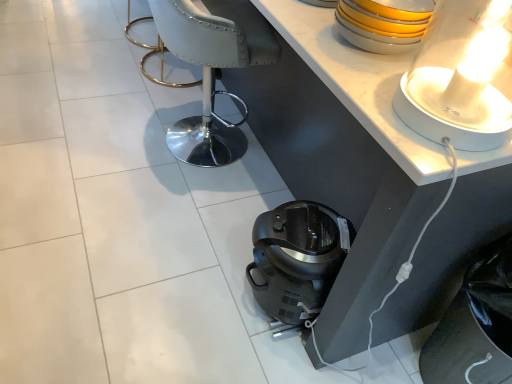
Question: Considering the relative positions of white glossy table at upper center and white leather armchair at center in the image provided, is white glossy table at upper center in front of white leather armchair at center?

Choices:
 (A) yes
 (B) no

Answer: (A)

Question: Is white glossy table at upper center wider than white leather armchair at center?

Choices:
 (A) yes
 (B) no

Answer: (A)

Question: Does white glossy table at upper center have a greater height compared to white leather armchair at center?

Choices:
 (A) no
 (B) yes

Answer: (A)

Question: Considering the relative sizes of white glossy table at upper center and white leather armchair at center in the image provided, is white glossy table at upper center thinner than white leather armchair at center?

Choices:
 (A) yes
 (B) no

Answer: (B)

Question: From a real-world perspective, is white glossy table at upper center positioned under white leather armchair at center based on gravity?

Choices:
 (A) no
 (B) yes

Answer: (B)

Question: From their relative heights in the image, would you say satin black coffee maker at lower center is taller or shorter than white glossy table at upper center?

Choices:
 (A) tall
 (B) short

Answer: (A)

Question: Considering the positions of satin black coffee maker at lower center and white glossy table at upper center in the image, is satin black coffee maker at lower center bigger or smaller than white glossy table at upper center?

Choices:
 (A) big
 (B) small

Answer: (B)

Question: Based on their positions, is satin black coffee maker at lower center located to the left or right of white glossy table at upper center?

Choices:
 (A) right
 (B) left

Answer: (A)

Question: From the image's perspective, is satin black coffee maker at lower center above or below white glossy table at upper center?

Choices:
 (A) below
 (B) above

Answer: (A)

Question: Is yellow glossy bowls at upper right to the left or to the right of white glossy table at upper center in the image?

Choices:
 (A) left
 (B) right

Answer: (B)

Question: Do you think yellow glossy bowls at upper right is within white glossy table at upper center, or outside of it?

Choices:
 (A) inside
 (B) outside

Answer: (B)

Question: From their relative heights in the image, would you say yellow glossy bowls at upper right is taller or shorter than white glossy table at upper center?

Choices:
 (A) tall
 (B) short

Answer: (A)

Question: In the image, is yellow glossy bowls at upper right positioned in front of or behind white glossy table at upper center?

Choices:
 (A) behind
 (B) front

Answer: (B)

Question: In the image, is yellow glossy bowls at upper right on the left side or the right side of white leather armchair at center?

Choices:
 (A) right
 (B) left

Answer: (A)

Question: Is yellow glossy bowls at upper right bigger or smaller than white leather armchair at center?

Choices:
 (A) big
 (B) small

Answer: (B)